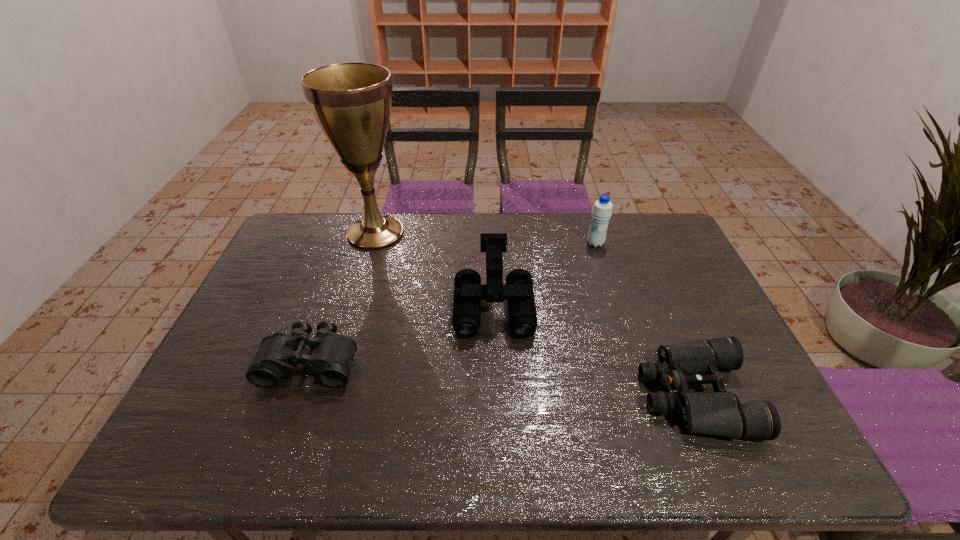
Where is `the tallest object`? This screenshot has height=540, width=960. the tallest object is located at coordinates (351, 102).

Find the location of `water bottle`. water bottle is located at coordinates (x=602, y=210).

Image resolution: width=960 pixels, height=540 pixels. I want to click on the second binoculars from left to right, so coord(466,320).

What are the coordinates of `the tallest binoculars` in the screenshot? It's located at (466, 320).

The width and height of the screenshot is (960, 540). I want to click on the leftmost binoculars, so click(331, 356).

You are a GUI agent. You are given a task and a screenshot of the screen. Output one action in this format:
    pyautogui.click(x=<x>, y=<y>)
    Task: Click on the rightmost binoculars
    The height and width of the screenshot is (540, 960).
    Given the screenshot: What is the action you would take?
    pyautogui.click(x=720, y=413)

The image size is (960, 540). Identify the location of vacant region located on the right of the tallest object. tap(447, 233).

Find the location of a particular element. vacant space located on the front of the water bottle is located at coordinates (605, 275).

Where is `vacant space located on the front lenses of the third object from left to right`? The width and height of the screenshot is (960, 540). vacant space located on the front lenses of the third object from left to right is located at coordinates (496, 387).

Locate an element on the screen. The height and width of the screenshot is (540, 960). free space located 0.150m at the eyepieces of the leftmost binoculars is located at coordinates (281, 446).